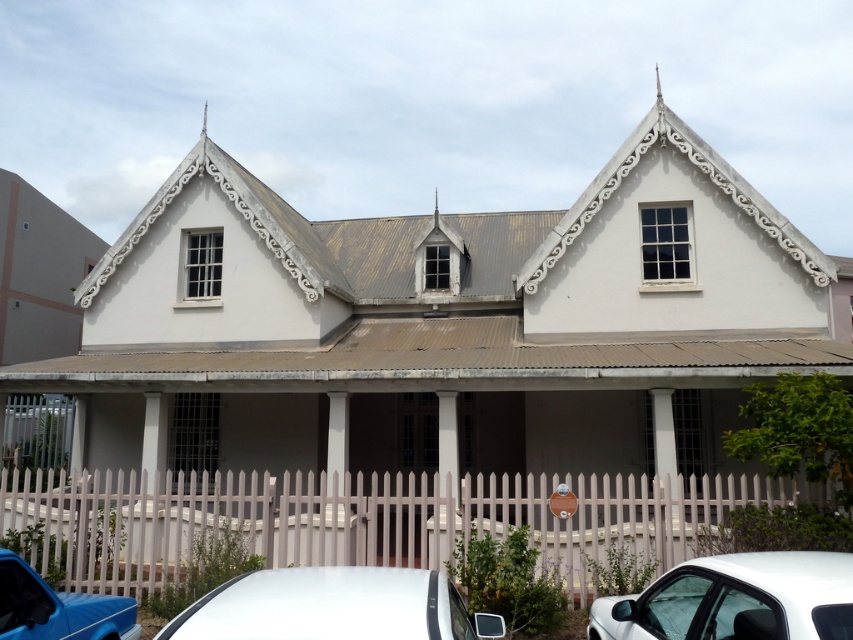
Which is more to the left, white picket fence at lower center or white glossy car at lower right?

Positioned to the left is white picket fence at lower center.

In the scene shown: Measure the distance between white picket fence at lower center and white glossy car at lower right.

white picket fence at lower center and white glossy car at lower right are 3.97 meters apart.

Is point (321, 547) positioned after point (780, 609)?

That is True.

The width and height of the screenshot is (853, 640). What are the coordinates of `white picket fence at lower center` in the screenshot? It's located at (358, 520).

Is white glossy car at lower right to the right of matte blue car at lower left from the viewer's perspective?

Correct, you'll find white glossy car at lower right to the right of matte blue car at lower left.

Does white glossy car at lower right appear on the left side of matte blue car at lower left?

In fact, white glossy car at lower right is to the right of matte blue car at lower left.

This screenshot has width=853, height=640. What are the coordinates of `white glossy car at lower right` in the screenshot? It's located at (735, 600).

Does white picket fence at lower center appear on the left side of matte blue car at lower left?

No, white picket fence at lower center is not to the left of matte blue car at lower left.

Who is positioned more to the right, white picket fence at lower center or matte blue car at lower left?

white picket fence at lower center is more to the right.

The image size is (853, 640). In order to click on white picket fence at lower center in this screenshot , I will do `click(358, 520)`.

At what (x,y) coordinates should I click in order to perform the action: click on white picket fence at lower center. Please return your answer as a coordinate pair (x, y). Looking at the image, I should click on 358,520.